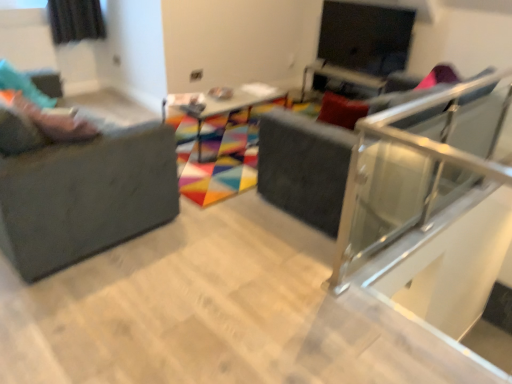
Question: Would you say matte black screen at upper right is part of matte gray studio couch at left's contents?

Choices:
 (A) yes
 (B) no

Answer: (B)

Question: Is matte gray studio couch at left to the left of matte black screen at upper right from the viewer's perspective?

Choices:
 (A) yes
 (B) no

Answer: (A)

Question: Is matte gray studio couch at left looking in the opposite direction of matte black screen at upper right?

Choices:
 (A) yes
 (B) no

Answer: (B)

Question: Does matte gray studio couch at left have a lesser height compared to matte black screen at upper right?

Choices:
 (A) no
 (B) yes

Answer: (A)

Question: Is matte gray studio couch at left at the right side of matte black screen at upper right?

Choices:
 (A) yes
 (B) no

Answer: (B)

Question: Considering the positions of matte pink shoes at left and wooden table at center in the image, is matte pink shoes at left wider or thinner than wooden table at center?

Choices:
 (A) thin
 (B) wide

Answer: (A)

Question: From their relative heights in the image, would you say matte pink shoes at left is taller or shorter than wooden table at center?

Choices:
 (A) short
 (B) tall

Answer: (A)

Question: Considering the relative positions of matte pink shoes at left and wooden table at center in the image provided, is matte pink shoes at left to the left or to the right of wooden table at center?

Choices:
 (A) left
 (B) right

Answer: (A)

Question: In the image, is matte pink shoes at left positioned in front of or behind wooden table at center?

Choices:
 (A) behind
 (B) front

Answer: (B)

Question: In terms of size, does matte gray studio couch at left appear bigger or smaller than matte black swivel chair at center?

Choices:
 (A) big
 (B) small

Answer: (B)

Question: Considering the positions of matte gray studio couch at left and matte black swivel chair at center in the image, is matte gray studio couch at left wider or thinner than matte black swivel chair at center?

Choices:
 (A) wide
 (B) thin

Answer: (B)

Question: From the image's perspective, is matte gray studio couch at left above or below matte black swivel chair at center?

Choices:
 (A) above
 (B) below

Answer: (B)

Question: In the image, is matte gray studio couch at left positioned in front of or behind matte black swivel chair at center?

Choices:
 (A) front
 (B) behind

Answer: (A)

Question: Choose the correct answer: Is matte gray studio couch at left inside matte black screen at upper right or outside it?

Choices:
 (A) inside
 (B) outside

Answer: (B)

Question: In the image, is matte gray studio couch at left on the left side or the right side of matte black screen at upper right?

Choices:
 (A) left
 (B) right

Answer: (A)